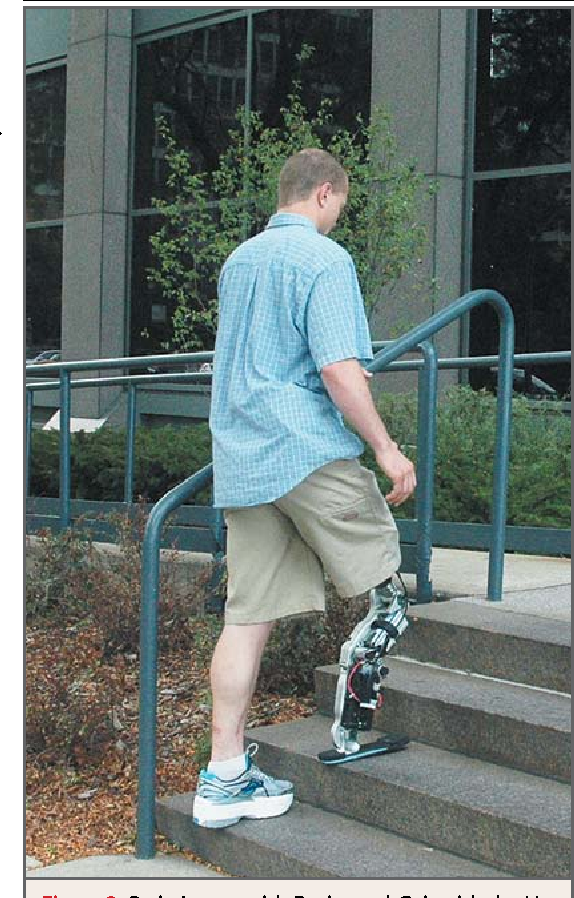
Find the location of `windows`. windows is located at coordinates (193, 81), (46, 117), (45, 269), (162, 268), (321, 77), (262, 214), (525, 80), (519, 258).